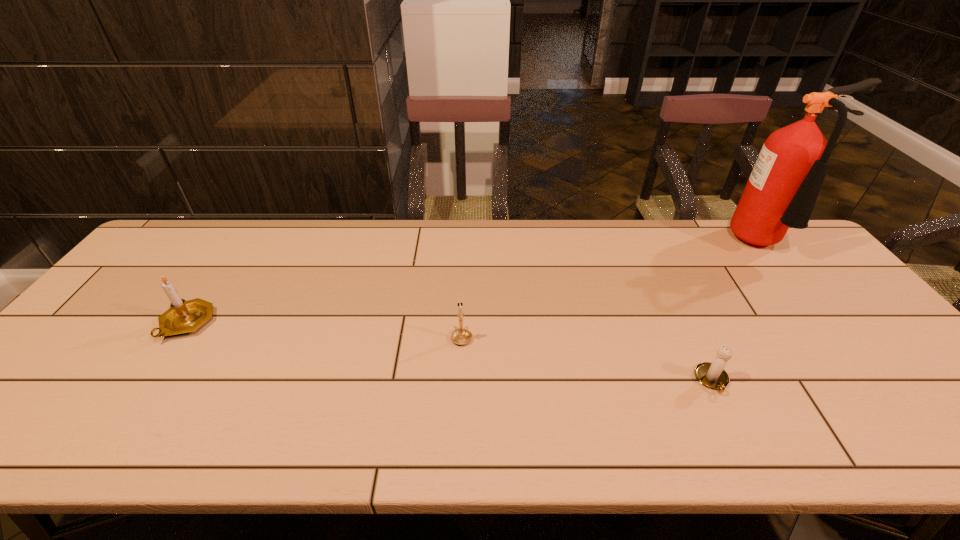
Image resolution: width=960 pixels, height=540 pixels. I want to click on fire extinguisher, so click(781, 192).

Identify the location of the farthest object. (781, 192).

Locate an element on the screen. the leftmost object is located at coordinates (184, 316).

Find the location of a particular element. This screenshot has height=540, width=960. the second tallest object is located at coordinates (184, 316).

You are a GUI agent. You are given a task and a screenshot of the screen. Output one action in this format:
    pyautogui.click(x=<x>, y=<y>)
    Task: Click on the second candle holder from left to right
    
    Given the screenshot: What is the action you would take?
    pyautogui.click(x=461, y=336)

You are a GUI agent. You are given a task and a screenshot of the screen. Output one action in this format:
    pyautogui.click(x=<x>, y=<y>)
    Task: Click on the second object from right to left
    Image resolution: width=960 pixels, height=540 pixels.
    Given the screenshot: What is the action you would take?
    pyautogui.click(x=712, y=375)

Find the location of a particular element. This screenshot has width=960, height=540. the rightmost candle holder is located at coordinates (712, 375).

At what (x,y) coordinates should I click in order to perform the action: click on vacant space situated at the nozzle of the farthest object. Please return your answer as a coordinate pair (x, y). This screenshot has height=540, width=960. Looking at the image, I should click on (852, 349).

The height and width of the screenshot is (540, 960). What are the coordinates of `vacant region located on the right of the leftmost candle holder` in the screenshot? It's located at (300, 323).

This screenshot has height=540, width=960. Find the location of `vacant region located 0.290m on the handle side of the second candle holder from right to left`. vacant region located 0.290m on the handle side of the second candle holder from right to left is located at coordinates [x=465, y=258].